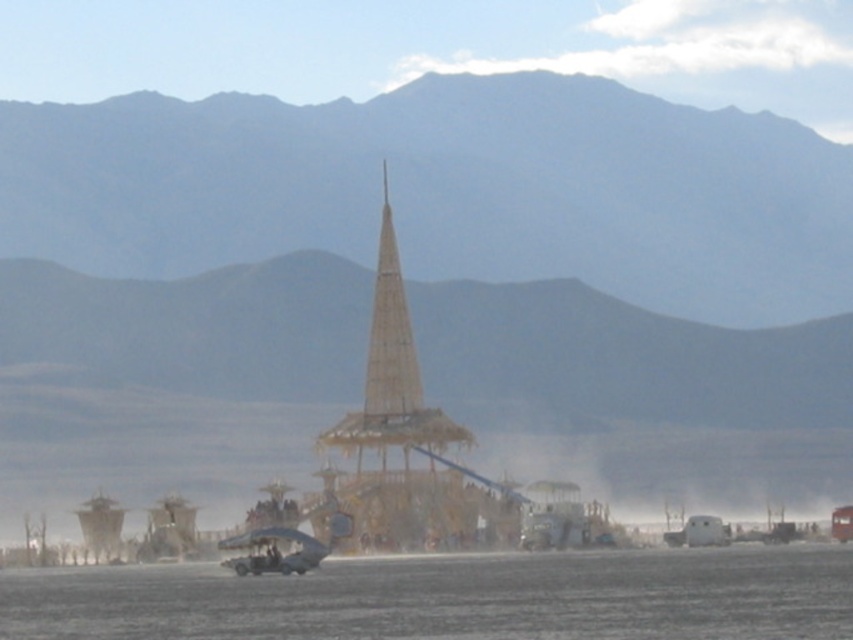
Question: In this image, where is clear ice at lower center located relative to wooden tower at center?

Choices:
 (A) right
 (B) left

Answer: (A)

Question: Which point is farther to the camera?

Choices:
 (A) desert sand mountain at center
 (B) metallic silver fighter jet at center
 (C) wooden tower at center
 (D) clear ice at lower center

Answer: (A)

Question: Which point is closer to the camera?

Choices:
 (A) clear ice at lower center
 (B) wooden tower at center
 (C) desert sand mountain at center
 (D) metallic silver fighter jet at center

Answer: (A)

Question: Does desert sand mountain at center appear on the right side of metallic silver fighter jet at center?

Choices:
 (A) yes
 (B) no

Answer: (A)

Question: Estimate the real-world distances between objects in this image. Which object is farther from the desert sand mountain at center?

Choices:
 (A) wooden tower at center
 (B) metallic silver fighter jet at center

Answer: (B)

Question: Can you confirm if desert sand mountain at center is thinner than clear ice at lower center?

Choices:
 (A) no
 (B) yes

Answer: (A)